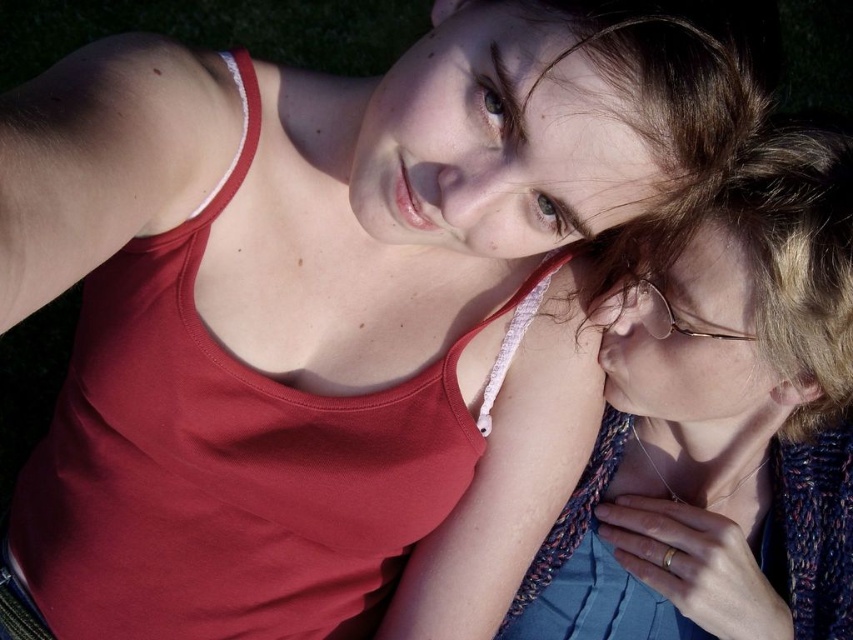
Does knitted blue sweater at right appear on the right side of green grass at upper left?

Indeed, knitted blue sweater at right is positioned on the right side of green grass at upper left.

In the scene shown: Can you confirm if knitted blue sweater at right is smaller than green grass at upper left?

No.

Find the location of a particular element. The width and height of the screenshot is (853, 640). knitted blue sweater at right is located at coordinates (721, 428).

Image resolution: width=853 pixels, height=640 pixels. Find the location of `knitted blue sweater at right`. knitted blue sweater at right is located at coordinates (721, 428).